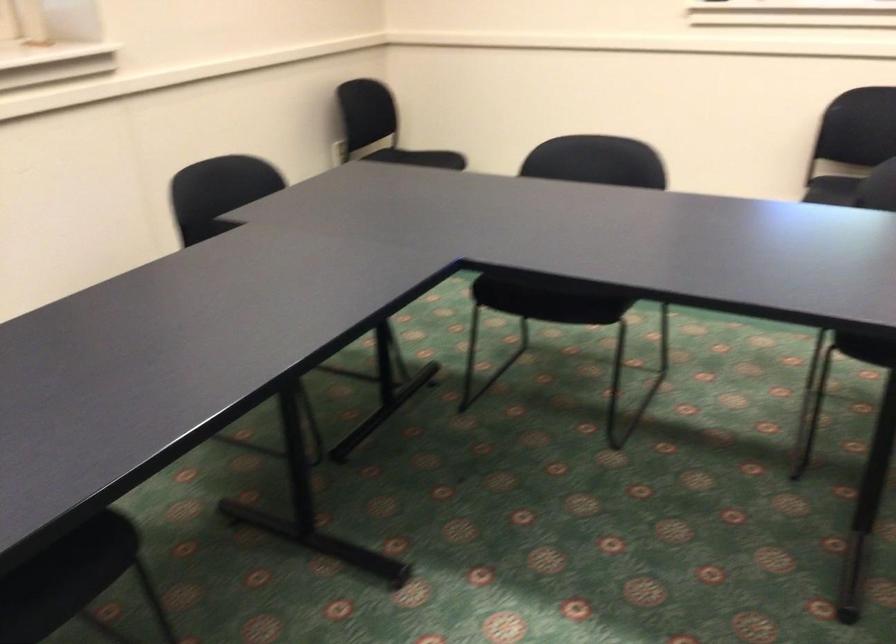
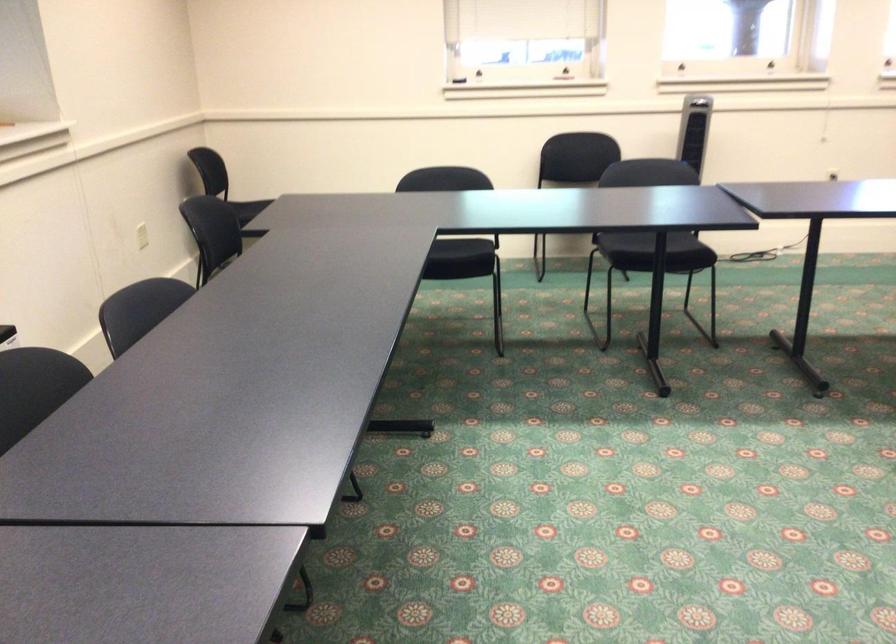
In the second image, find the point that corresponds to (565,295) in the first image.

(462, 257)